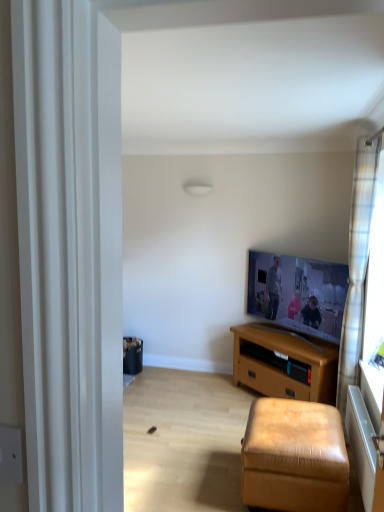
Question: From a real-world perspective, is plaid fabric curtain at right positioned above or below leather-like stool at lower right?

Choices:
 (A) below
 (B) above

Answer: (B)

Question: From the image's perspective, relative to leather-like stool at lower right, is plaid fabric curtain at right above or below?

Choices:
 (A) below
 (B) above

Answer: (B)

Question: Considering the real-world distances, which object is farthest from the brown wooden tv stand at center?

Choices:
 (A) flat screen tv at upper right
 (B) plaid fabric curtain at right
 (C) leather-like stool at lower right

Answer: (C)

Question: Based on their relative distances, which object is nearer to the brown wooden tv stand at center?

Choices:
 (A) plaid fabric curtain at right
 (B) flat screen tv at upper right
 (C) leather-like stool at lower right

Answer: (B)